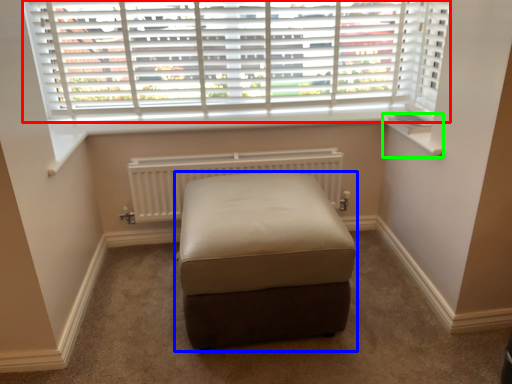
Question: Based on their relative distances, which object is farther from window (highlighted by a red box)? Choose from furniture (highlighted by a blue box) and window sill (highlighted by a green box).

Choices:
 (A) furniture
 (B) window sill

Answer: (A)